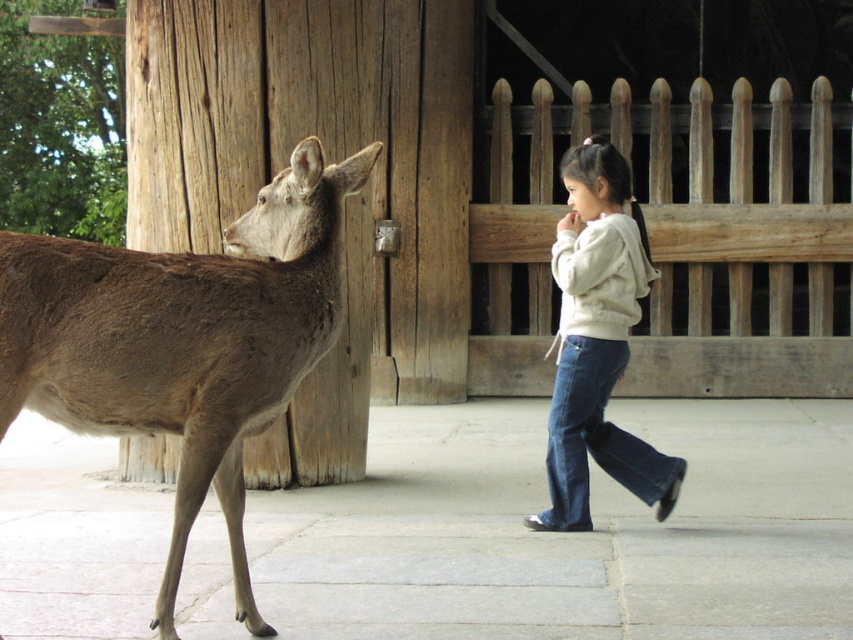
You are standing in the same position as the girl and want to throw a small pebble to the light beige hoodie at center. If you can throw the pebble 7 meters, will it reach the hoodie?

The light beige hoodie at center and the viewer are 6.93 meters apart. Since the throwing distance is 7 meters, the pebble will reach the hoodie.

You are a wildlife photographer trying to capture a shot of the brown fur deer at left and the light beige hoodie at center. Which animal or clothing item is shorter in height?

The brown fur deer at left has a lesser height compared to the light beige hoodie at center, so the brown fur deer at left is shorter.